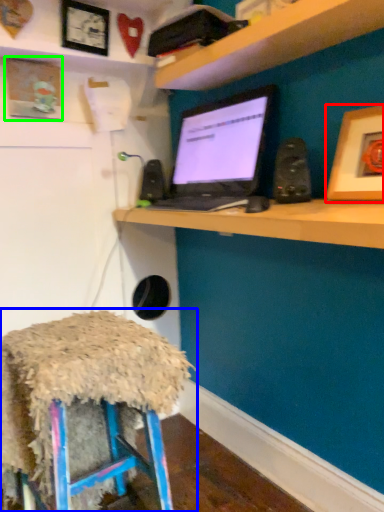
Question: Which object is positioned farthest from picture frame (highlighted by a red box)? Select from stool (highlighted by a blue box) and picture frame (highlighted by a green box).

Choices:
 (A) stool
 (B) picture frame

Answer: (B)